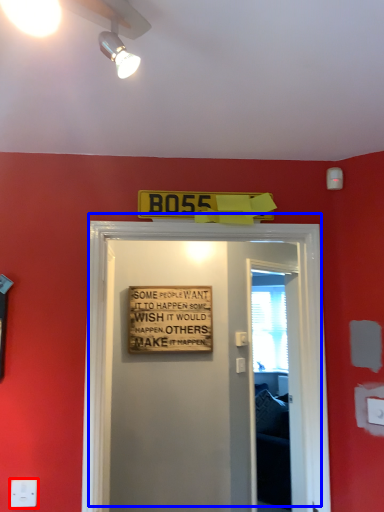
Question: Which object appears farthest to the camera in this image, electric outlet (highlighted by a red box) or door (highlighted by a blue box)?

Choices:
 (A) electric outlet
 (B) door

Answer: (B)